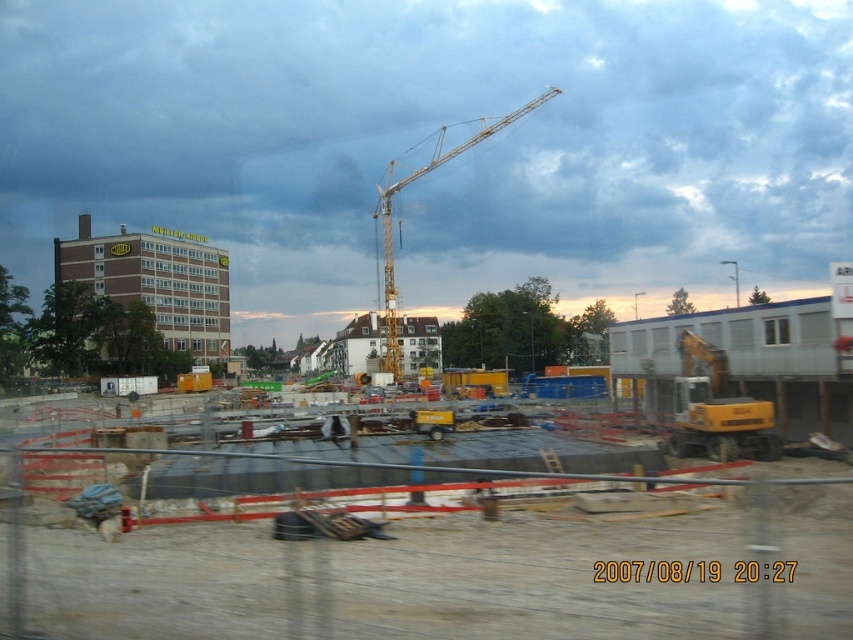
You are a delivery driver who needs to park your truck in the construction site. The entrance to the site is at the bottom left corner. According to the map, where should you park your truck relative to the yellow metallic truck at center?

The yellow metallic truck at center is located at point (426, 547), so you should park your truck to the right and above the yellow metallic truck at center to stay within the designated parking area.

Looking at this image, you are a construction worker who needs to transport a large steel beam that requires a vehicle with a maximum height clearance of 2 meters. You have access to the yellow metallic truck at center and the yellow metallic crane at center. Which vehicle can safely carry the beam without exceeding the height limit?

The yellow metallic truck at center has a lesser height compared to the yellow metallic crane at center, so the yellow metallic truck at center can safely carry the beam without exceeding the height limit of 2 meters.

You are a construction worker who needs to move a heavy beam from the brown brick building at left to the yellow metallic crane at center. Which direction should you move the beam to get it closer to the crane?

The brown brick building at left is positioned on the left side of the yellow metallic crane at center, so you should move the beam to the right to get it closer to the crane.